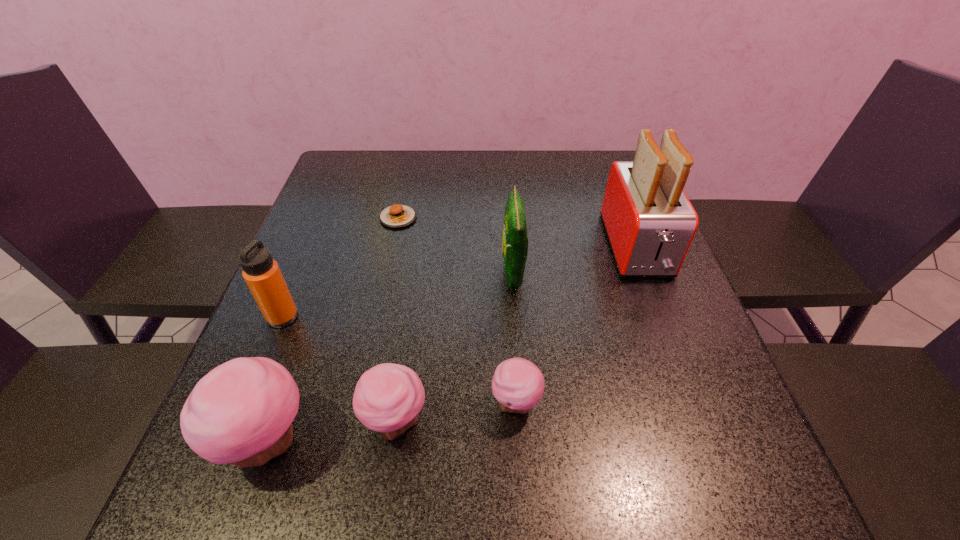
This screenshot has width=960, height=540. I want to click on free space located on the back of the tallest cupcake, so click(x=298, y=356).

Image resolution: width=960 pixels, height=540 pixels. What are the coordinates of `vacant area located 0.130m on the right of the second tallest cupcake` in the screenshot? It's located at (505, 422).

Locate an element on the screen. The image size is (960, 540). blank space located 0.360m on the back of the rightmost cupcake is located at coordinates [x=506, y=251].

What are the coordinates of `blank area located 0.140m on the right of the food` in the screenshot? It's located at (470, 218).

This screenshot has width=960, height=540. What are the coordinates of `vacant space located on the front-facing side of the crisp (potato chip)` in the screenshot? It's located at (329, 274).

Image resolution: width=960 pixels, height=540 pixels. Identify the location of vacant space located on the front-facing side of the crisp (potato chip). (329, 274).

The image size is (960, 540). Find the location of `free region located 0.360m on the front-facing side of the crisp (potato chip)`. free region located 0.360m on the front-facing side of the crisp (potato chip) is located at coordinates (343, 274).

In order to click on free space located 0.310m on the front-facing side of the rightmost object in this screenshot , I will do `click(701, 416)`.

In order to click on free spot located on the back of the thermos bottle in this screenshot , I will do `click(319, 228)`.

The height and width of the screenshot is (540, 960). Find the location of `cupcake that is at the left edge`. cupcake that is at the left edge is located at coordinates (241, 412).